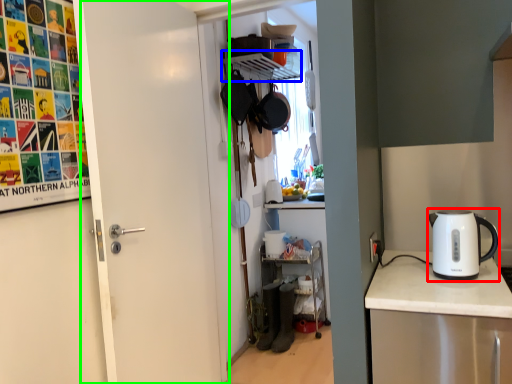
Question: Based on their relative distances, which object is nearer to kettle (highlighted by a red box)? Choose from shelf (highlighted by a blue box) and door (highlighted by a green box).

Choices:
 (A) shelf
 (B) door

Answer: (B)